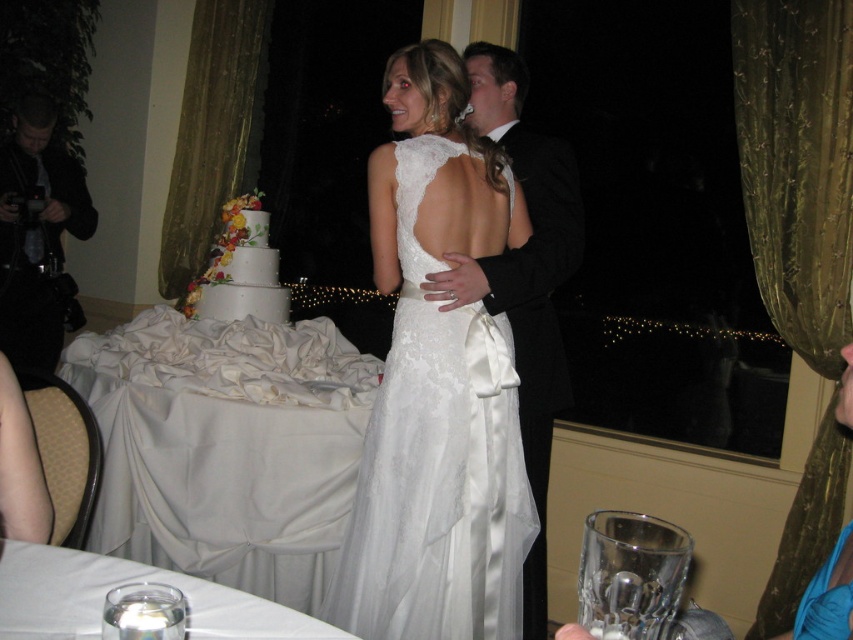
Can you confirm if lace fabric dress at center is bigger than white textured cake at left?

Yes.

Can you confirm if lace fabric dress at center is thinner than white textured cake at left?

No, lace fabric dress at center is not thinner than white textured cake at left.

Measure the distance between lace fabric dress at center and camera.

lace fabric dress at center is 1.81 meters away from camera.

Where is `lace fabric dress at center`? The image size is (853, 640). lace fabric dress at center is located at coordinates (438, 384).

Can you confirm if lace fabric dress at center is smaller than black satin tuxedo at right?

Yes, lace fabric dress at center is smaller than black satin tuxedo at right.

Which is above, lace fabric dress at center or black satin tuxedo at right?

black satin tuxedo at right is above.

Who is more distant from viewer, (x=482, y=611) or (x=564, y=227)?

The point (x=564, y=227) is behind.

You are a GUI agent. You are given a task and a screenshot of the screen. Output one action in this format:
    pyautogui.click(x=<x>, y=<y>)
    Task: Click on the lace fabric dress at center
    
    Given the screenshot: What is the action you would take?
    pyautogui.click(x=438, y=384)

Which is more to the left, black satin tuxedo at right or white textured cake at left?

white textured cake at left

Between black satin tuxedo at right and white textured cake at left, which one is positioned higher?

white textured cake at left is higher up.

Find the location of a particular element. The width and height of the screenshot is (853, 640). black satin tuxedo at right is located at coordinates (524, 280).